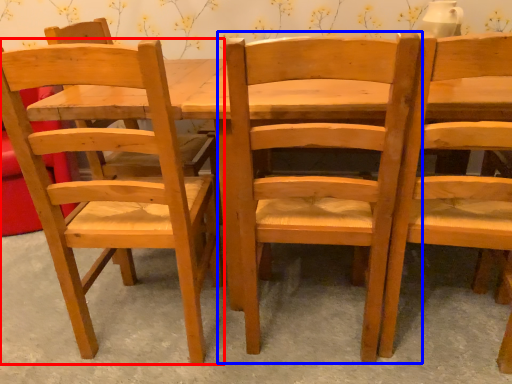
Question: Which point is further to the camera, chair (highlighted by a red box) or chair (highlighted by a blue box)?

Choices:
 (A) chair
 (B) chair

Answer: (A)